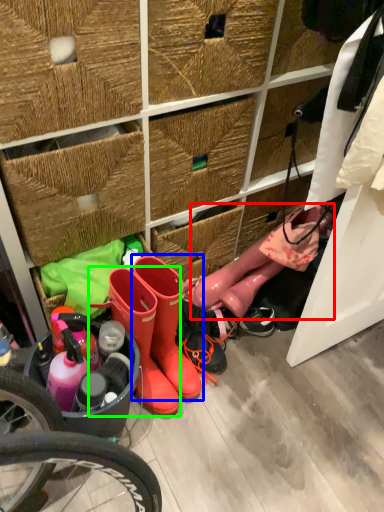
Question: Based on their relative distances, which object is farther from footwear (highlighted by a red box)? Choose from footwear (highlighted by a blue box) and footwear (highlighted by a green box).

Choices:
 (A) footwear
 (B) footwear

Answer: (B)